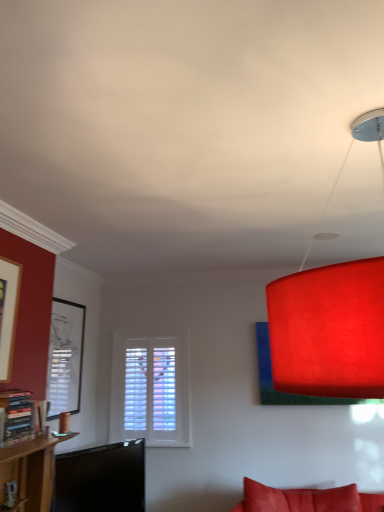
Question: From the image's perspective, would you say wooden bookshelf at left is positioned over matte black picture frame at left?

Choices:
 (A) yes
 (B) no

Answer: (A)

Question: Is wooden bookshelf at left oriented towards matte black picture frame at left?

Choices:
 (A) no
 (B) yes

Answer: (A)

Question: Is wooden bookshelf at left shorter than matte black picture frame at left?

Choices:
 (A) yes
 (B) no

Answer: (A)

Question: Is wooden bookshelf at left directly adjacent to matte black picture frame at left?

Choices:
 (A) no
 (B) yes

Answer: (A)

Question: Does wooden bookshelf at left have a smaller size compared to matte black picture frame at left?

Choices:
 (A) yes
 (B) no

Answer: (A)

Question: Does wooden bookshelf at left come in front of matte black picture frame at left?

Choices:
 (A) no
 (B) yes

Answer: (B)

Question: From a real-world perspective, is matte black picture frame at left physically above matte red lampshade at upper right?

Choices:
 (A) no
 (B) yes

Answer: (A)

Question: Does matte black picture frame at left appear on the right side of matte red lampshade at upper right?

Choices:
 (A) no
 (B) yes

Answer: (A)

Question: Would you say matte red lampshade at upper right is part of matte black picture frame at left's contents?

Choices:
 (A) yes
 (B) no

Answer: (B)

Question: Can you confirm if matte black picture frame at left is positioned to the left of matte red lampshade at upper right?

Choices:
 (A) no
 (B) yes

Answer: (B)

Question: Is matte red lampshade at upper right at the back of matte black picture frame at left?

Choices:
 (A) yes
 (B) no

Answer: (B)

Question: Is there a large distance between matte black picture frame at left and matte red lampshade at upper right?

Choices:
 (A) yes
 (B) no

Answer: (A)

Question: Does wooden bookshelf at left lie in front of matte red lampshade at upper right?

Choices:
 (A) no
 (B) yes

Answer: (A)